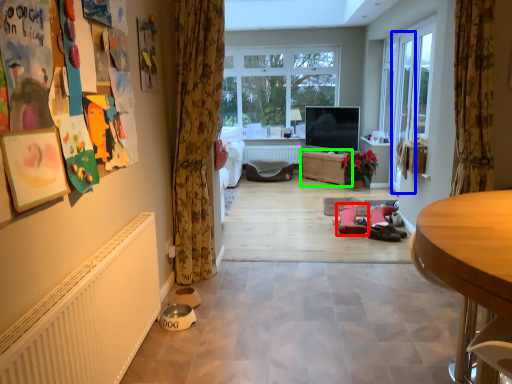
Question: Estimate the real-world distances between objects in this image. Which object is closer to footwear (highlighted by a red box), screen door (highlighted by a blue box) or cabinetry (highlighted by a green box)?

Choices:
 (A) screen door
 (B) cabinetry

Answer: (A)